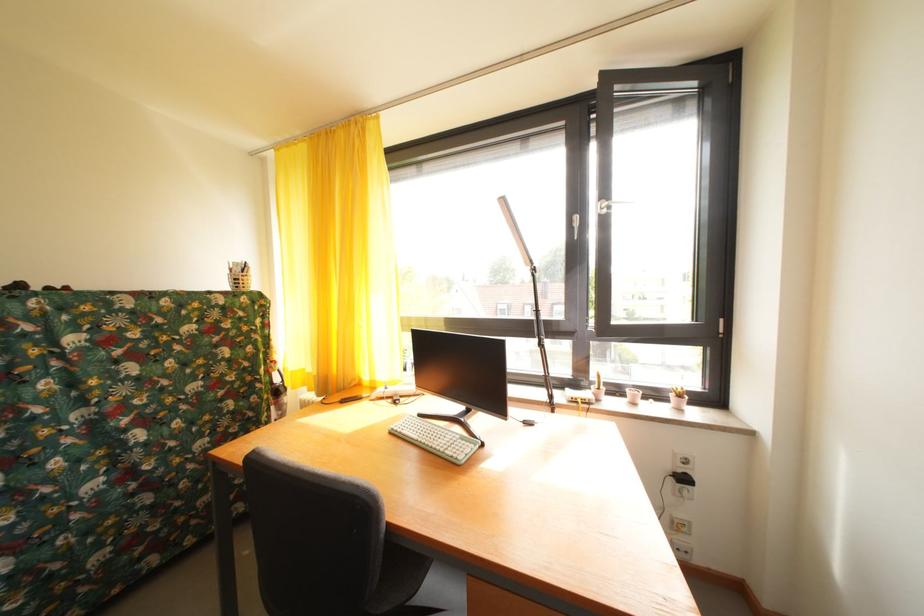
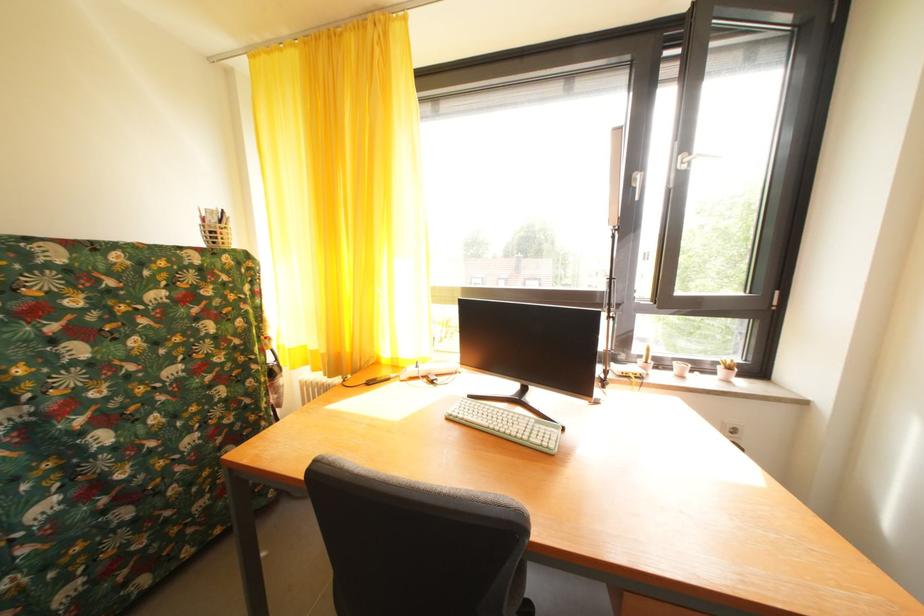
The point at (429, 421) is marked in the first image. Where is the corresponding point in the second image?

(479, 402)